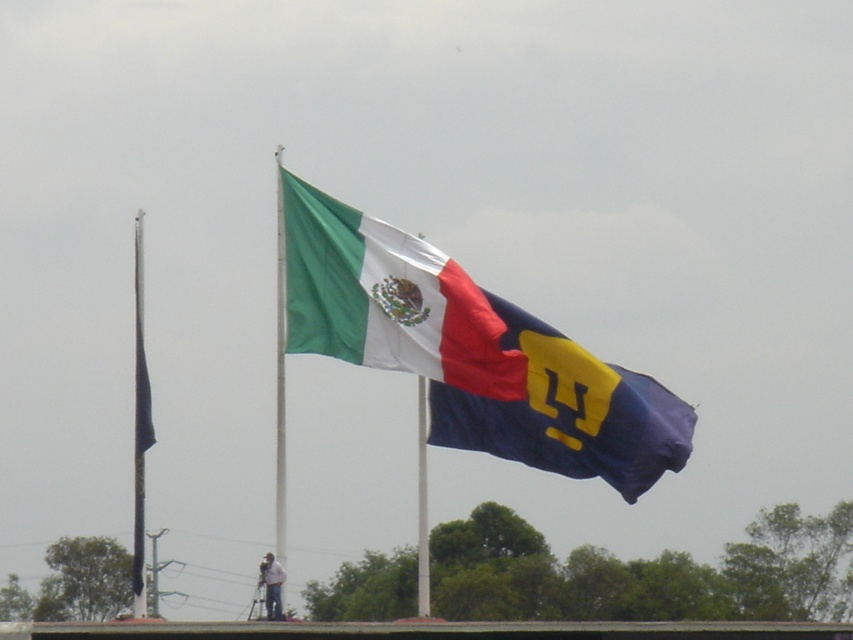
Which of these two, textured cotton flag at center or blue fabric flag at center, stands shorter?

textured cotton flag at center is shorter.

Based on the photo, can you confirm if textured cotton flag at center is positioned below blue fabric flag at center?

Actually, textured cotton flag at center is above blue fabric flag at center.

The width and height of the screenshot is (853, 640). Find the location of `textured cotton flag at center`. textured cotton flag at center is located at coordinates (387, 300).

Find the location of a particular element. This screenshot has height=640, width=853. textured cotton flag at center is located at coordinates (387, 300).

Looking at this image, between textured cotton flag at center and black matte flag pole at left, which one has more height?

Standing taller between the two is black matte flag pole at left.

Can you confirm if textured cotton flag at center is positioned to the right of black matte flag pole at left?

Indeed, textured cotton flag at center is positioned on the right side of black matte flag pole at left.

This screenshot has height=640, width=853. I want to click on textured cotton flag at center, so click(x=387, y=300).

The height and width of the screenshot is (640, 853). What are the coordinates of `textured cotton flag at center` in the screenshot? It's located at (387, 300).

Does blue fabric flag at center have a lesser width compared to black matte flag pole at left?

Indeed, blue fabric flag at center has a lesser width compared to black matte flag pole at left.

Measure the distance between blue fabric flag at center and camera.

blue fabric flag at center and camera are 87.79 meters apart.

Does point (596, 416) lie in front of point (142, 536)?

Yes, point (596, 416) is closer to viewer.

Where is `blue fabric flag at center`? Image resolution: width=853 pixels, height=640 pixels. blue fabric flag at center is located at coordinates (567, 412).